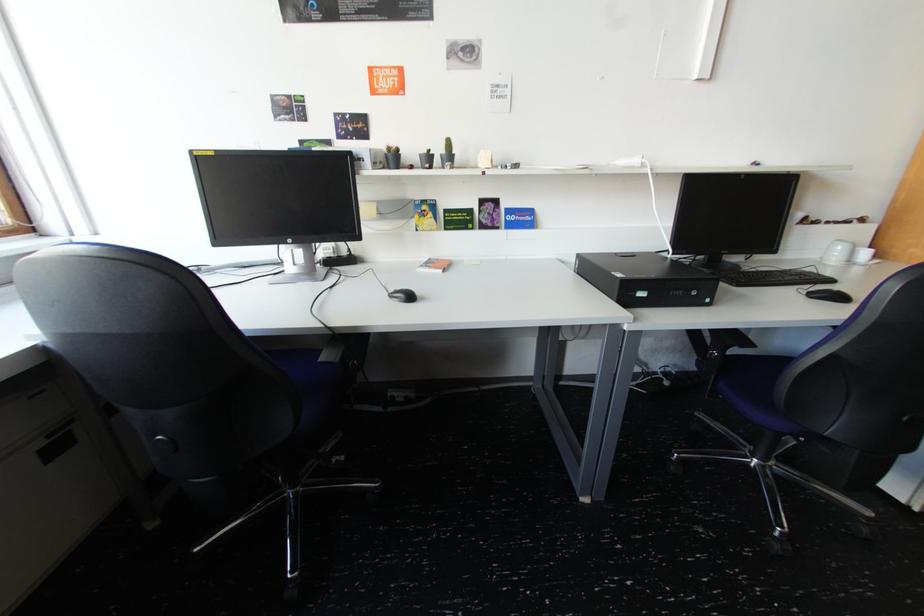
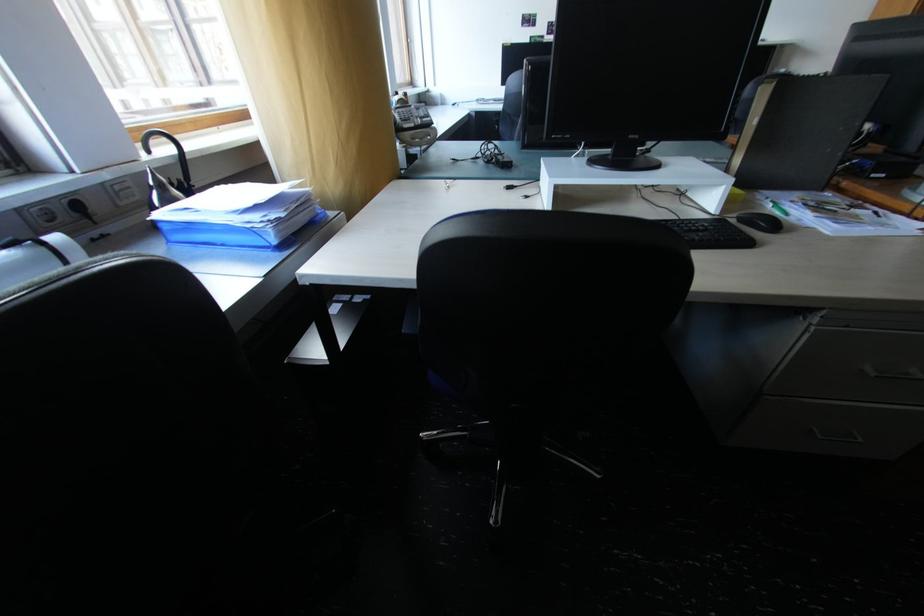
Question: I am providing you with two images of the same scene from different viewpoints. Please identify which objects are invisible in image2.

Choices:
 (A) black binder
 (B) green control knob
 (C) power strip switch
 (D) black computer mouse

Answer: (D)